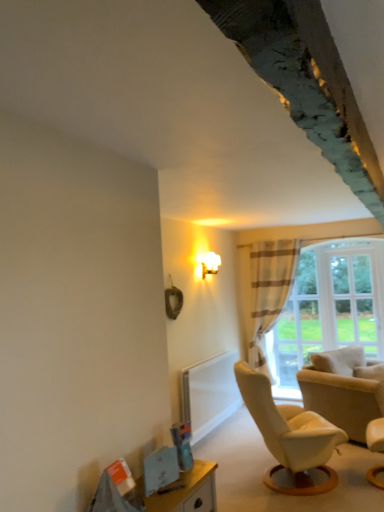
Question: Can you confirm if white sheer curtain at center is smaller than white leather chair at lower right, marked as the first chair in a front-to-back arrangement?

Choices:
 (A) no
 (B) yes

Answer: (A)

Question: Would you say white sheer curtain at center is outside white leather chair at lower right, marked as the first chair in a front-to-back arrangement?

Choices:
 (A) no
 (B) yes

Answer: (B)

Question: Is white sheer curtain at center taller than white leather chair at lower right, acting as the second chair starting from the back?

Choices:
 (A) yes
 (B) no

Answer: (A)

Question: Can you confirm if white sheer curtain at center is positioned to the left of white leather chair at lower right, acting as the second chair starting from the back?

Choices:
 (A) yes
 (B) no

Answer: (A)

Question: Is white sheer curtain at center far away from white leather chair at lower right, acting as the second chair starting from the back?

Choices:
 (A) yes
 (B) no

Answer: (A)

Question: Could you tell me if white sheer curtain at center is facing white leather chair at lower right, marked as the first chair in a front-to-back arrangement?

Choices:
 (A) no
 (B) yes

Answer: (A)

Question: Does white sheer curtain at center have a lesser height compared to clear glass window at right?

Choices:
 (A) no
 (B) yes

Answer: (A)

Question: Is white sheer curtain at center at the right side of clear glass window at right?

Choices:
 (A) yes
 (B) no

Answer: (B)

Question: Is white sheer curtain at center oriented towards clear glass window at right?

Choices:
 (A) no
 (B) yes

Answer: (A)

Question: Does white sheer curtain at center have a lesser width compared to clear glass window at right?

Choices:
 (A) yes
 (B) no

Answer: (B)

Question: Is white sheer curtain at center turned away from clear glass window at right?

Choices:
 (A) no
 (B) yes

Answer: (A)

Question: Is white sheer curtain at center taller than clear glass window at right?

Choices:
 (A) yes
 (B) no

Answer: (A)

Question: Is the depth of white sheer curtain at center greater than that of beige fabric chair at lower right, which is counted as the second chair, starting from the front?

Choices:
 (A) yes
 (B) no

Answer: (A)